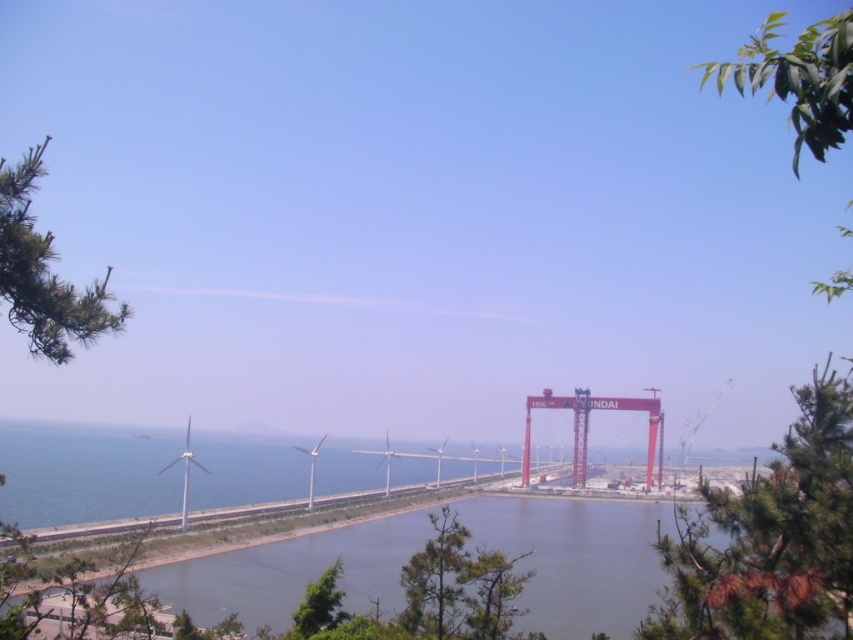
Question: Among these points, which one is farthest from the camera?

Choices:
 (A) (654, 406)
 (B) (795, 116)
 (C) (787, 429)

Answer: (C)

Question: Among these objects, which one is nearest to the camera?

Choices:
 (A) green leafy tree at lower center
 (B) clear water at lower center

Answer: (B)

Question: Can you confirm if brown textured tree at lower right is thinner than green pine tree at left?

Choices:
 (A) no
 (B) yes

Answer: (B)

Question: In this image, where is green leafy branch at upper right located relative to red metal crane at center?

Choices:
 (A) above
 (B) below

Answer: (A)

Question: Can you confirm if red metal crane at center is positioned to the right of green leafy tree at lower center?

Choices:
 (A) yes
 (B) no

Answer: (A)

Question: Which is nearer to the brown textured tree at lower right?

Choices:
 (A) green pine tree at left
 (B) red metal crane at center
 (C) green leafy tree at lower center
 (D) clear water at lower center

Answer: (A)